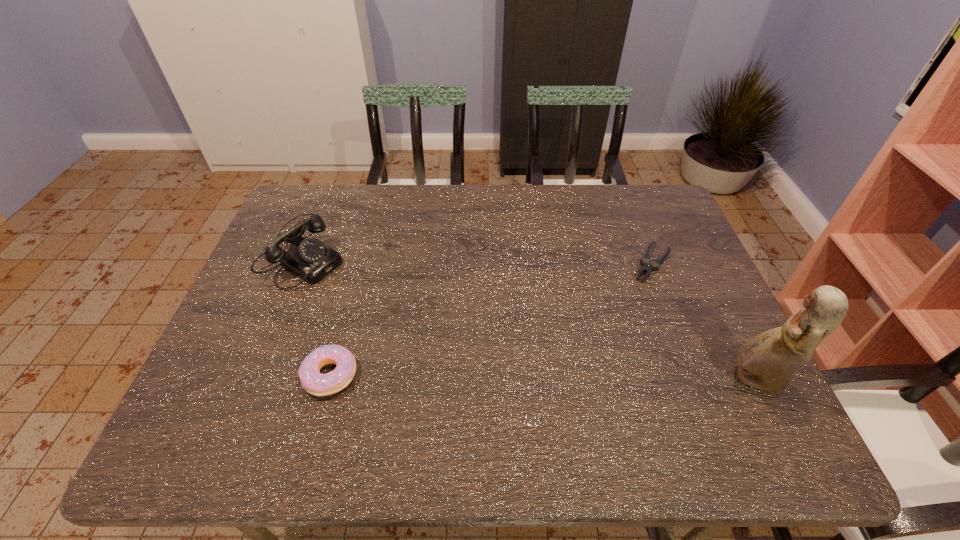
Where is `free space located at the gripping part of the second object from right to left`? This screenshot has width=960, height=540. free space located at the gripping part of the second object from right to left is located at coordinates (598, 355).

The height and width of the screenshot is (540, 960). Find the location of `free space located 0.340m at the gripping part of the second object from right to left`. free space located 0.340m at the gripping part of the second object from right to left is located at coordinates (590, 367).

At what (x,y) coordinates should I click in order to perform the action: click on vacant space located at the gripping part of the second object from right to left. Please return your answer as a coordinate pair (x, y). Looking at the image, I should click on (620, 320).

The width and height of the screenshot is (960, 540). I want to click on free location located 0.180m on the front-facing side of the third shortest object, so click(380, 299).

This screenshot has height=540, width=960. Find the location of `vacant area situated on the front-facing side of the third shortest object`. vacant area situated on the front-facing side of the third shortest object is located at coordinates (350, 282).

You are a GUI agent. You are given a task and a screenshot of the screen. Output one action in this format:
    pyautogui.click(x=<x>, y=<y>)
    Task: Click on the vacant space located 0.070m on the front-facing side of the third shortest object
    
    Given the screenshot: What is the action you would take?
    pyautogui.click(x=350, y=282)

This screenshot has height=540, width=960. Identify the location of object that is at the far edge. (308, 258).

This screenshot has width=960, height=540. Identify the location of doughnut present at the near edge. (315, 383).

Where is `figurine located at the near edge`? Image resolution: width=960 pixels, height=540 pixels. figurine located at the near edge is located at coordinates (768, 361).

Where is `object at the left edge`? This screenshot has height=540, width=960. object at the left edge is located at coordinates (308, 258).